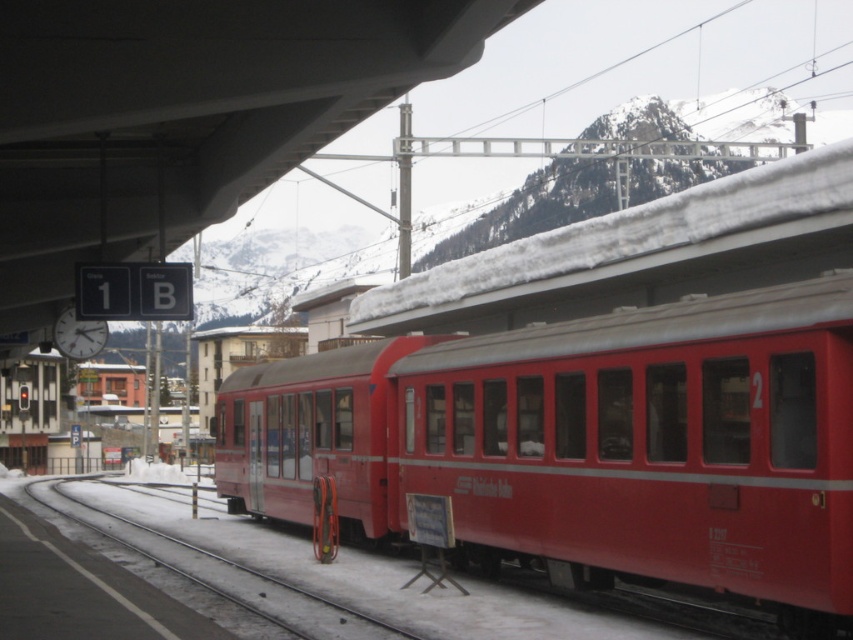
You are standing on the platform at the train station and want to board the matte red train at center. The metallic red track at lower center is where you need to walk to reach the train. Is the track closer to you or farther away compared to the train?

The matte red train at center is closer to the viewer than the metallic red track at lower center, so the track is farther away from you compared to the train.